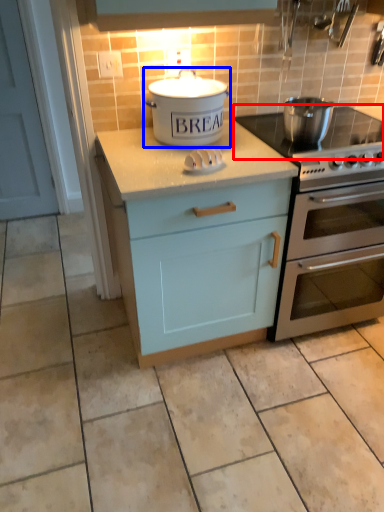
Question: Which object is closer to the camera taking this photo, gas stove (highlighted by a red box) or kitchen appliance (highlighted by a blue box)?

Choices:
 (A) gas stove
 (B) kitchen appliance

Answer: (A)